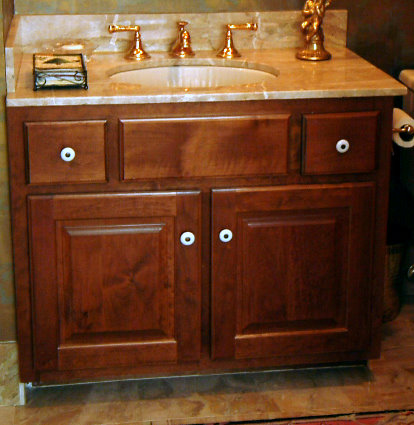
Identify the location of sink. (232, 78).